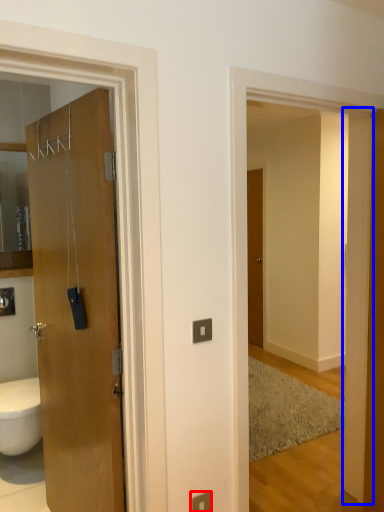
Question: Which object is further to the camera taking this photo, electric outlet (highlighted by a red box) or pillar (highlighted by a blue box)?

Choices:
 (A) electric outlet
 (B) pillar

Answer: (B)